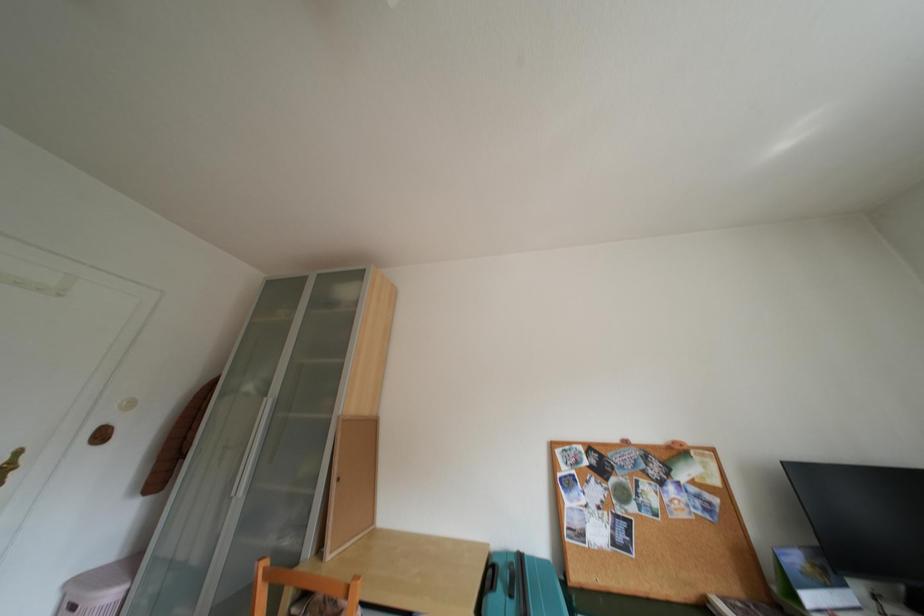
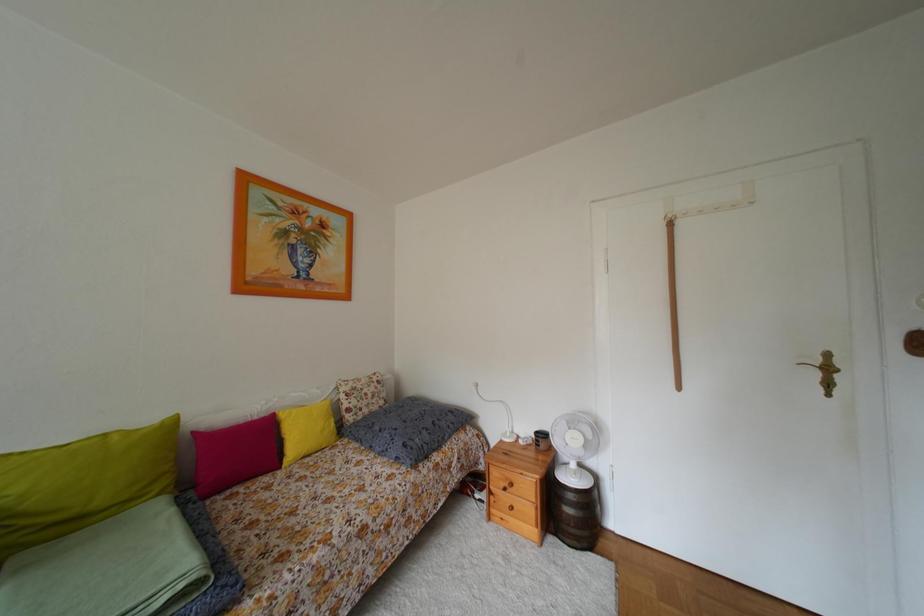
Question: The camera is either moving clockwise (left) or counter-clockwise (right) around the object. The first image is from the beginning of the video and the second image is from the end. Is the camera moving left or right when shooting the video?

Choices:
 (A) Left
 (B) Right

Answer: (B)